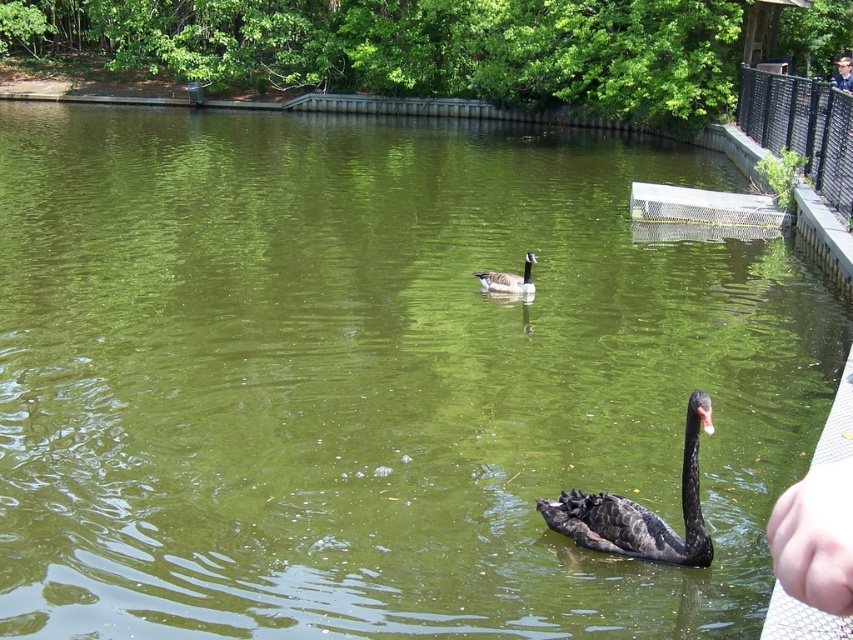
Question: Is black glossy swan at lower right closer to camera compared to brown matte goose at center?

Choices:
 (A) yes
 (B) no

Answer: (A)

Question: Is black glossy swan at lower right in front of brown matte goose at center?

Choices:
 (A) no
 (B) yes

Answer: (B)

Question: Which object appears farthest from the camera in this image?

Choices:
 (A) black glossy swan at lower right
 (B) brown matte goose at center

Answer: (B)

Question: Is black glossy swan at lower right to the left of brown matte goose at center from the viewer's perspective?

Choices:
 (A) yes
 (B) no

Answer: (B)

Question: Among these points, which one is farthest from the camera?

Choices:
 (A) (498, 289)
 (B) (705, 534)

Answer: (A)

Question: Which point appears farthest from the camera in this image?

Choices:
 (A) (554, 504)
 (B) (521, 280)

Answer: (B)